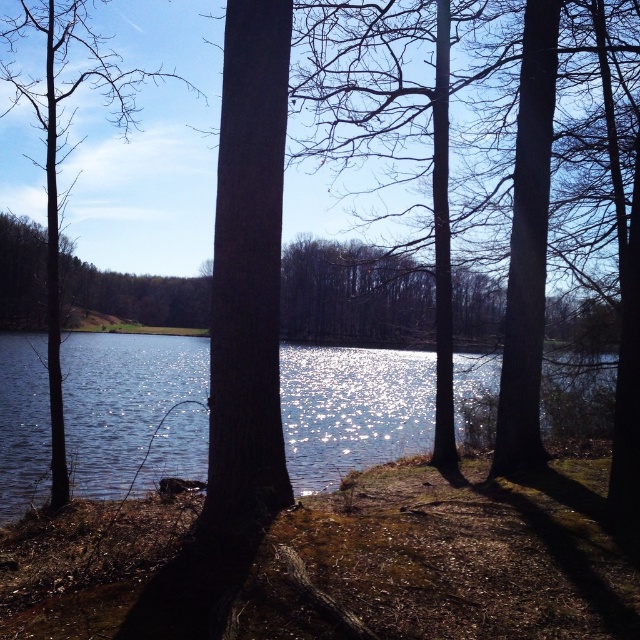
You are standing in the serene natural scene and want to walk from point A to point B. Point A is at coordinate point (204, 419) and point B is at coordinate point (61, 472). Which direction should you move to get closer to point B?

To move closer to point B at coordinate point (61, 472) from point A at coordinate point (204, 419), you should move downward and to the right since point B is located lower and further to the right compared to point A.

You are standing at the edge of the lake and want to take a photo of the glistening water at center. If your camera can focus on objects up to 20 feet away, will you need to move closer to capture a clear image?

The glistening water at center is 22.40 feet away from the camera. Since your camera can focus up to 20 feet, you need to move closer to ensure the glistening water at center is within the focus range.

You are standing in the natural scene and want to take a photo of the glistening water at center and the brown matte tree at left. Which object will appear larger in the photo?

The glistening water at center will appear larger in the photo because it is closer to the viewer than the brown matte tree at left.